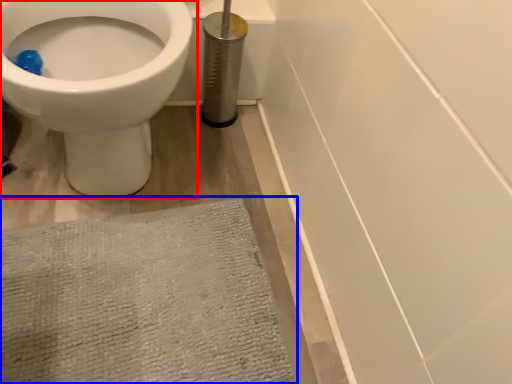
Question: Among these objects, which one is farthest to the camera, toilet (highlighted by a red box) or bath mat (highlighted by a blue box)?

Choices:
 (A) toilet
 (B) bath mat

Answer: (B)